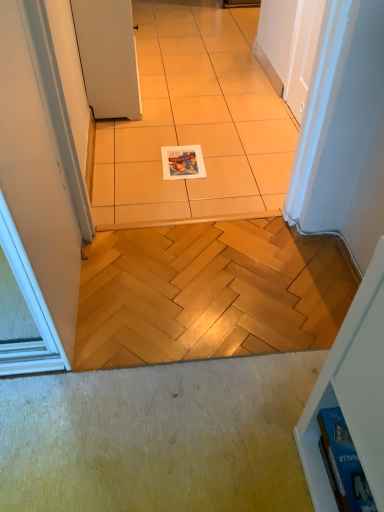
Question: Is white matte door at upper left located within beige ceramic tile at center?

Choices:
 (A) no
 (B) yes

Answer: (A)

Question: From a real-world perspective, is beige ceramic tile at center physically above white matte door at upper left?

Choices:
 (A) no
 (B) yes

Answer: (A)

Question: Considering the relative positions of beige ceramic tile at center and white matte door at upper left in the image provided, is beige ceramic tile at center to the right of white matte door at upper left from the viewer's perspective?

Choices:
 (A) no
 (B) yes

Answer: (B)

Question: Can you confirm if beige ceramic tile at center is shorter than white matte door at upper left?

Choices:
 (A) yes
 (B) no

Answer: (A)

Question: Does beige ceramic tile at center come behind white matte door at upper left?

Choices:
 (A) yes
 (B) no

Answer: (B)

Question: Is point (104, 166) positioned closer to the camera than point (342, 441)?

Choices:
 (A) farther
 (B) closer

Answer: (A)

Question: Considering the positions of beige ceramic tile at center and blue glossy magazine at lower right, positioned as the first magazine in bottom-to-top order, in the image, is beige ceramic tile at center wider or thinner than blue glossy magazine at lower right, positioned as the first magazine in bottom-to-top order,?

Choices:
 (A) wide
 (B) thin

Answer: (A)

Question: From the image's perspective, is beige ceramic tile at center located above or below blue glossy magazine at lower right, which ranks as the second magazine in left-to-right order?

Choices:
 (A) above
 (B) below

Answer: (A)

Question: Considering their positions, is beige ceramic tile at center located in front of or behind blue glossy magazine at lower right, the 1th magazine from the right?

Choices:
 (A) front
 (B) behind

Answer: (B)

Question: Considering the positions of point (173, 192) and point (94, 56), is point (173, 192) closer or farther from the camera than point (94, 56)?

Choices:
 (A) farther
 (B) closer

Answer: (B)

Question: Would you say beige ceramic tile at center is inside or outside white matte door at upper left?

Choices:
 (A) inside
 (B) outside

Answer: (B)

Question: In terms of size, does beige ceramic tile at center appear bigger or smaller than white matte door at upper left?

Choices:
 (A) big
 (B) small

Answer: (B)

Question: In the image, is beige ceramic tile at center positioned in front of or behind white matte door at upper left?

Choices:
 (A) front
 (B) behind

Answer: (A)

Question: Is white matte door at upper left wider or thinner than beige ceramic tile at center?

Choices:
 (A) wide
 (B) thin

Answer: (B)

Question: Looking at the image, does white matte door at upper left seem bigger or smaller compared to beige ceramic tile at center?

Choices:
 (A) small
 (B) big

Answer: (B)